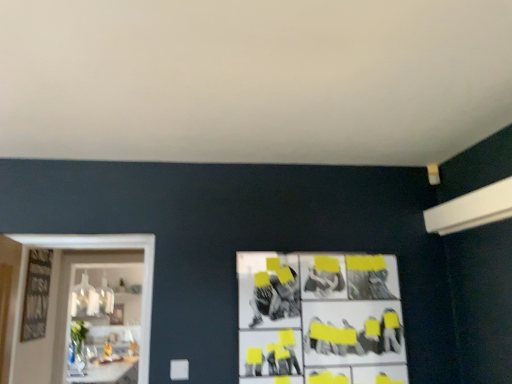
Question: In terms of size, does white glossy shelf at left appear bigger or smaller than black and white collage at center?

Choices:
 (A) small
 (B) big

Answer: (B)

Question: Looking at their shapes, would you say white glossy shelf at left is wider or thinner than black and white collage at center?

Choices:
 (A) wide
 (B) thin

Answer: (A)

Question: Which object is positioned closest to the white glossy table at lower left?

Choices:
 (A) white glossy shelf at left
 (B) black and white collage at center

Answer: (A)

Question: Estimate the real-world distances between objects in this image. Which object is farther from the white glossy shelf at left?

Choices:
 (A) white glossy table at lower left
 (B) black and white collage at center

Answer: (B)